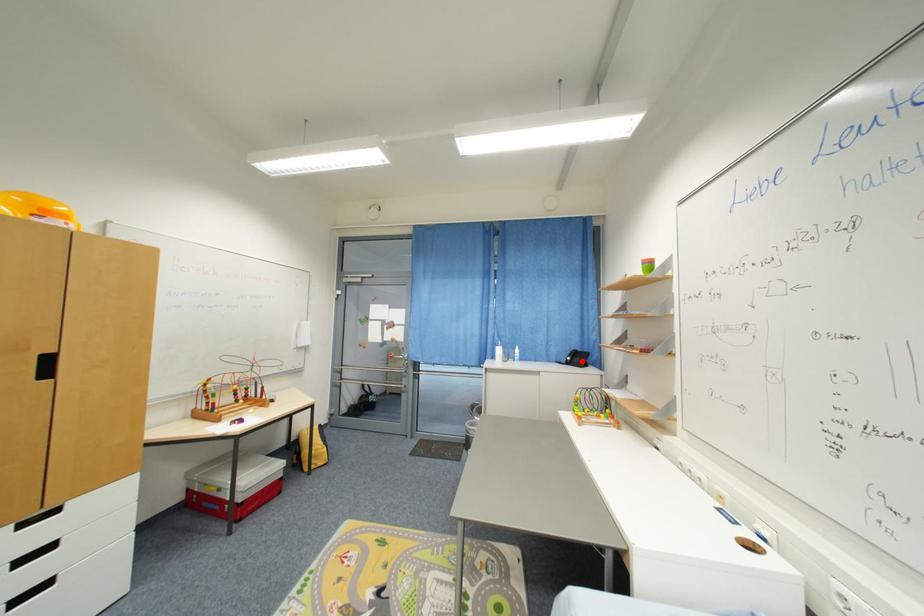
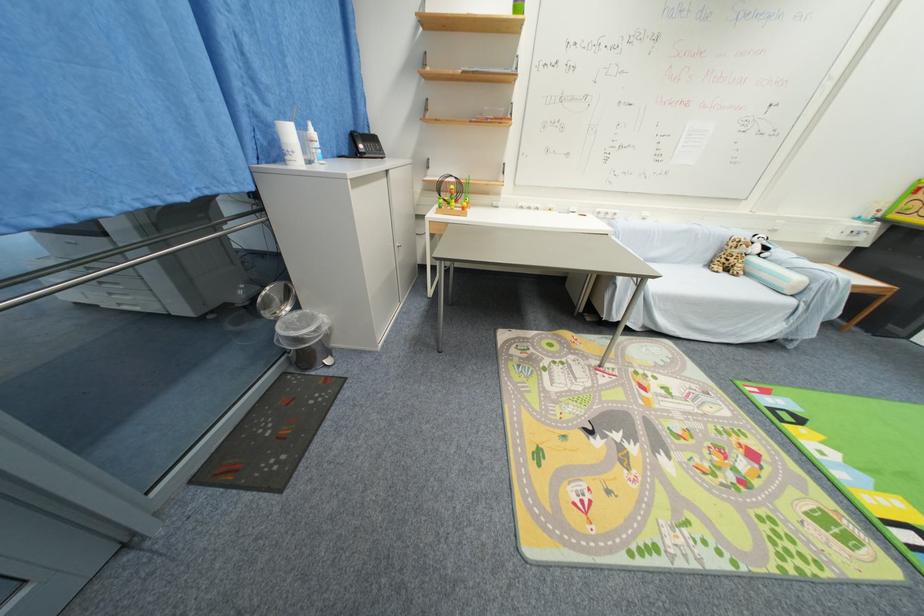
Question: I am providing you with two images of the same scene from different viewpoints. Given a red point in image1, look at the same physical point in image2. Is it:

Choices:
 (A) Closer to the viewpoint
 (B) Farther from the viewpoint

Answer: (A)